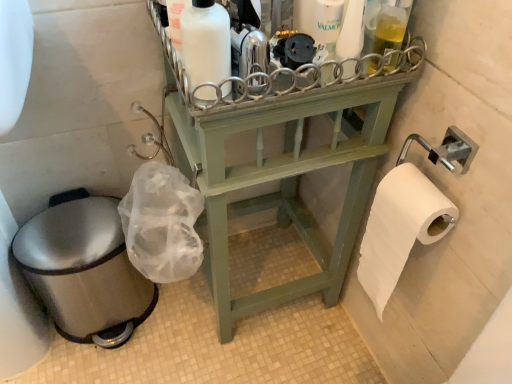
Where is `empty space that is ontop of brushed metal toilet bowl at lower left (from a real-world perspective)`? empty space that is ontop of brushed metal toilet bowl at lower left (from a real-world perspective) is located at coordinates (79, 229).